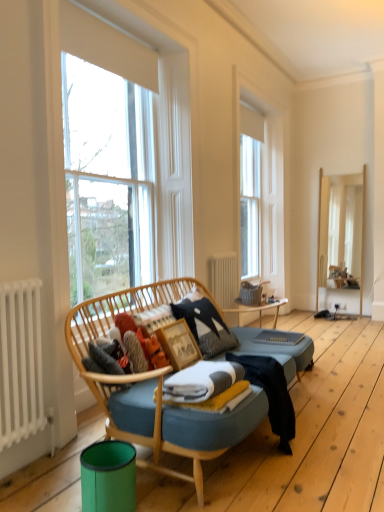
Question: From a real-world perspective, is wooden picture frame at center above or below clear glass window at left?

Choices:
 (A) above
 (B) below

Answer: (B)

Question: Considering the positions of point (163, 345) and point (173, 99), is point (163, 345) closer or farther from the camera than point (173, 99)?

Choices:
 (A) closer
 (B) farther

Answer: (A)

Question: Which of these objects is positioned farthest from the white metallic radiator at left, placed as the first radiator when sorted from front to back?

Choices:
 (A) clear glass window at left
 (B) wooden mirror at right
 (C) white radiator at center, which is counted as the 1th radiator, starting from the right
 (D) fluffy orange plush at center
 (E) wooden picture frame at center

Answer: (B)

Question: Which of these objects is positioned farthest from the clear glass window at left?

Choices:
 (A) white wood window frame at upper center
 (B) fluffy orange plush at center
 (C) wooden picture frame at center
 (D) textured gray pillow at center
 (E) wooden mirror at right

Answer: (E)